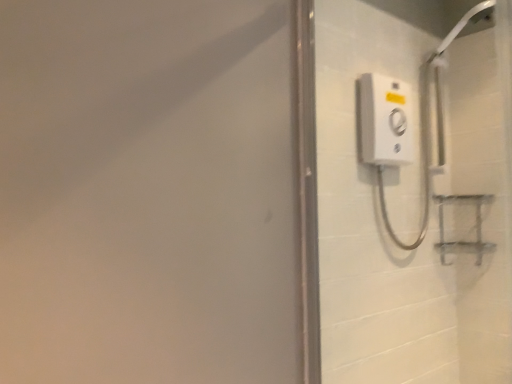
Describe the element at coordinates (412, 201) in the screenshot. Image resolution: width=512 pixels, height=384 pixels. I see `white plastic shower control at right` at that location.

At what (x,y) coordinates should I click in order to perform the action: click on white plastic shower control at right. Please return your answer as a coordinate pair (x, y). The image size is (512, 384). Looking at the image, I should click on (412, 201).

What do you see at coordinates (428, 121) in the screenshot? I see `white plastic shower at upper right` at bounding box center [428, 121].

I want to click on white plastic shower at upper right, so click(x=428, y=121).

Where is `white plastic shower control at right`? Image resolution: width=512 pixels, height=384 pixels. white plastic shower control at right is located at coordinates (412, 201).

Does white plastic shower control at right appear on the right side of white plastic shower at upper right?

Incorrect, white plastic shower control at right is not on the right side of white plastic shower at upper right.

Does white plastic shower control at right come in front of white plastic shower at upper right?

Yes, white plastic shower control at right is in front of white plastic shower at upper right.

Is point (369, 342) farther from viewer compared to point (439, 138)?

That is False.

From the image's perspective, is white plastic shower control at right on top of white plastic shower at upper right?

No.

From a real-world perspective, who is located higher, white plastic shower control at right or white plastic shower at upper right?

In real-world perspective, white plastic shower at upper right is above.

Is white plastic shower control at right wider than white plastic shower at upper right?

No, white plastic shower control at right is not wider than white plastic shower at upper right.

Looking at this image, between white plastic shower control at right and white plastic shower at upper right, which one has more height?

With more height is white plastic shower control at right.

Based on the photo, does white plastic shower control at right have a larger size compared to white plastic shower at upper right?

Incorrect, white plastic shower control at right is not larger than white plastic shower at upper right.

From the picture: Is white plastic shower at upper right surrounded by white plastic shower control at right?

No, white plastic shower control at right does not contain white plastic shower at upper right.

Is white plastic shower control at right next to white plastic shower at upper right?

No.

Could you tell me if white plastic shower control at right is turned towards white plastic shower at upper right?

Yes.

Identify the location of screen door below the white plastic shower at upper right (from the image's perspective). This screenshot has width=512, height=384. (412, 201).

Looking at this image, which is more to the left, white plastic shower at upper right or white plastic shower control at right?

white plastic shower control at right is more to the left.

Relative to white plastic shower control at right, is white plastic shower at upper right in front or behind?

In the image, white plastic shower at upper right appears behind white plastic shower control at right.

Considering the positions of point (440, 98) and point (448, 290), is point (440, 98) closer or farther from the camera than point (448, 290)?

Point (440, 98) is farther from the camera than point (448, 290).

From the image's perspective, is white plastic shower at upper right located beneath white plastic shower control at right?

No, from the image's perspective, white plastic shower at upper right is not beneath white plastic shower control at right.

From a real-world perspective, is white plastic shower at upper right located higher than white plastic shower control at right?

Correct, in the physical world, white plastic shower at upper right is higher than white plastic shower control at right.

Is white plastic shower at upper right wider than white plastic shower control at right?

Yes.

Is white plastic shower at upper right taller than white plastic shower control at right?

Incorrect, the height of white plastic shower at upper right is not larger of that of white plastic shower control at right.

Is white plastic shower at upper right smaller than white plastic shower control at right?

Actually, white plastic shower at upper right might be larger than white plastic shower control at right.

Is white plastic shower control at right located within white plastic shower at upper right?

No.

Is white plastic shower at upper right next to white plastic shower control at right?

No, white plastic shower at upper right is not in contact with white plastic shower control at right.

Looking at this image, is white plastic shower at upper right positioned with its back to white plastic shower control at right?

That's not correct — white plastic shower at upper right is not looking away from white plastic shower control at right.

How many degrees apart are the facing directions of white plastic shower at upper right and white plastic shower control at right?

The facing directions of white plastic shower at upper right and white plastic shower control at right are 85.3 degrees apart.

At what (x,y) coordinates should I click in order to perform the action: click on screen door below the white plastic shower at upper right (from a real-world perspective). Please return your answer as a coordinate pair (x, y). Looking at the image, I should click on (412, 201).

Locate an element on the screen. This screenshot has width=512, height=384. screen door on the left of white plastic shower at upper right is located at coordinates (412, 201).

This screenshot has width=512, height=384. In the image, there is a white plastic shower at upper right. In order to click on screen door below it (from a real-world perspective) in this screenshot , I will do `click(412, 201)`.